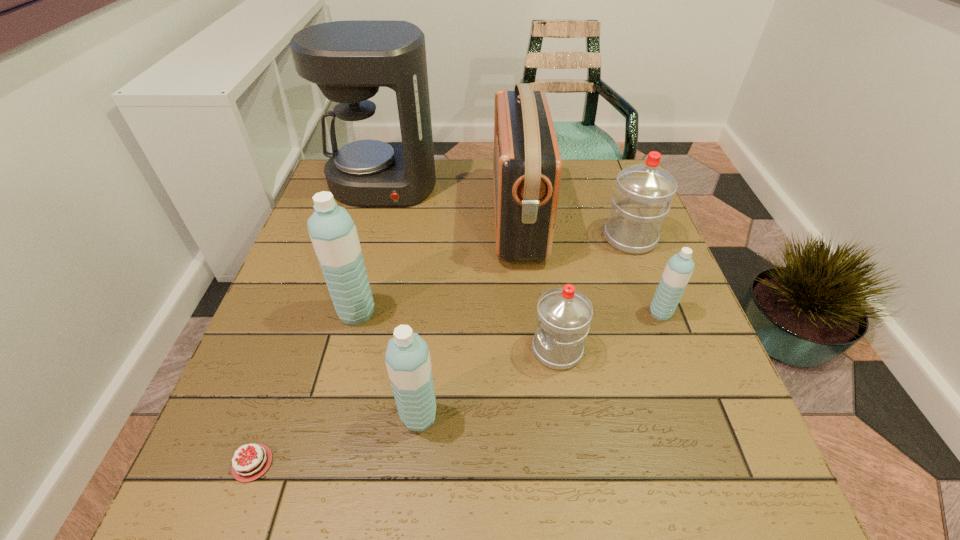
Locate an element on the screen. This screenshot has height=540, width=960. vacant space located 0.250m on the handle side of the farther white water bottle is located at coordinates (605, 171).

You are a GUI agent. You are given a task and a screenshot of the screen. Output one action in this format:
    pyautogui.click(x=<x>, y=<y>)
    Task: Click on the free space located 0.090m on the handle side of the farther white water bottle
    The height and width of the screenshot is (540, 960).
    Given the screenshot: What is the action you would take?
    pyautogui.click(x=616, y=202)

The height and width of the screenshot is (540, 960). I want to click on free space located 0.150m on the right of the nearest blue water bottle, so click(x=521, y=416).

The width and height of the screenshot is (960, 540). Identify the location of vacant region located 0.370m on the front of the smallest blue water bottle. (734, 510).

Image resolution: width=960 pixels, height=540 pixels. I want to click on vacant region located on the handle side of the left white water bottle, so click(446, 350).

Locate an element on the screen. blank space located on the handle side of the left white water bottle is located at coordinates (471, 350).

Where is `vacant space located 0.170m on the handle side of the left white water bottle`? This screenshot has width=960, height=540. vacant space located 0.170m on the handle side of the left white water bottle is located at coordinates (446, 350).

The image size is (960, 540). Identify the location of free space located 0.300m on the back of the red chocolate cake. (314, 294).

I want to click on coffee maker at the far edge, so click(348, 60).

Find the location of a particular element. This screenshot has height=540, width=960. radio receiver located in the far edge section of the desktop is located at coordinates (527, 165).